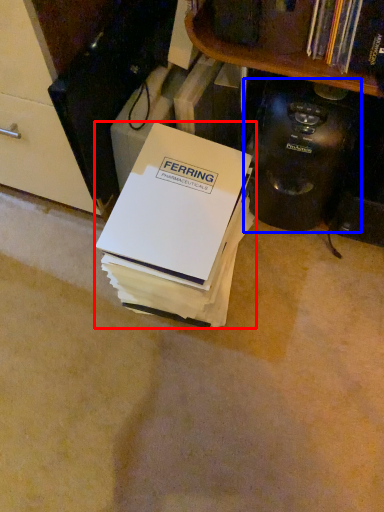
Question: Which of the following is the closest to the observer, box (highlighted by a red box) or appliance (highlighted by a blue box)?

Choices:
 (A) box
 (B) appliance

Answer: (A)